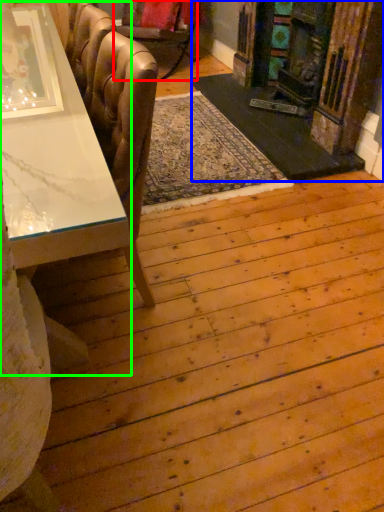
Question: Estimate the real-world distances between objects in this image. Which object is farther from chair (highlighted by a red box), fireplace (highlighted by a blue box) or table (highlighted by a green box)?

Choices:
 (A) fireplace
 (B) table

Answer: (B)